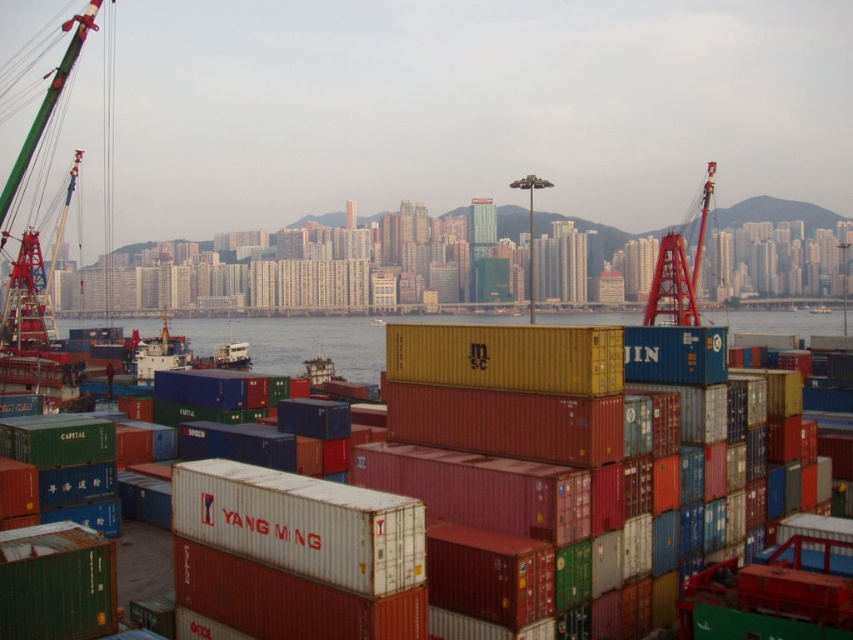
Question: Is blue water at center in front of red metallic crane at right?

Choices:
 (A) no
 (B) yes

Answer: (B)

Question: Which object is farther from the camera taking this photo?

Choices:
 (A) blue water at center
 (B) red metallic crane at right

Answer: (B)

Question: Is blue water at center further to camera compared to red metallic crane at right?

Choices:
 (A) yes
 (B) no

Answer: (B)

Question: Is blue water at center wider than red metallic crane at right?

Choices:
 (A) yes
 (B) no

Answer: (A)